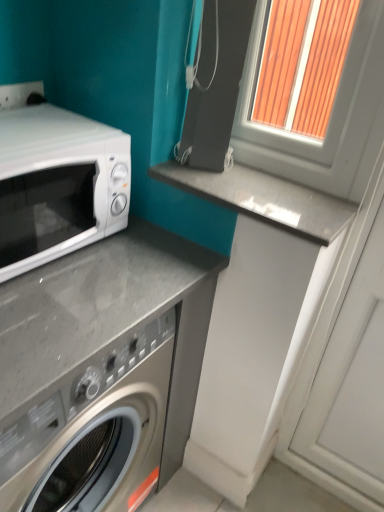
Question: Can you confirm if gray polished stone counter top at center is positioned to the right of white glossy microwave at left?

Choices:
 (A) no
 (B) yes

Answer: (B)

Question: From the image's perspective, is gray polished stone counter top at center beneath white glossy microwave at left?

Choices:
 (A) yes
 (B) no

Answer: (B)

Question: Can you confirm if gray polished stone counter top at center is thinner than white glossy microwave at left?

Choices:
 (A) no
 (B) yes

Answer: (B)

Question: Is gray polished stone counter top at center directly adjacent to white glossy microwave at left?

Choices:
 (A) yes
 (B) no

Answer: (B)

Question: Considering the relative positions of gray polished stone counter top at center and white glossy microwave at left in the image provided, is gray polished stone counter top at center behind white glossy microwave at left?

Choices:
 (A) yes
 (B) no

Answer: (A)

Question: Is white plastic window frame at upper right to the left or to the right of gray polished stone counter top at center in the image?

Choices:
 (A) left
 (B) right

Answer: (B)

Question: Is white plastic window frame at upper right taller or shorter than gray polished stone counter top at center?

Choices:
 (A) short
 (B) tall

Answer: (B)

Question: From the image's perspective, is white plastic window frame at upper right positioned above or below gray polished stone counter top at center?

Choices:
 (A) above
 (B) below

Answer: (A)

Question: In the image, is white plastic window frame at upper right positioned in front of or behind gray polished stone counter top at center?

Choices:
 (A) front
 (B) behind

Answer: (A)

Question: Considering the positions of gray polished stone counter top at center and white plastic window frame at upper right in the image, is gray polished stone counter top at center taller or shorter than white plastic window frame at upper right?

Choices:
 (A) short
 (B) tall

Answer: (A)

Question: In terms of width, does gray polished stone counter top at center look wider or thinner when compared to white plastic window frame at upper right?

Choices:
 (A) wide
 (B) thin

Answer: (A)

Question: From a real-world perspective, is gray polished stone counter top at center positioned above or below white plastic window frame at upper right?

Choices:
 (A) below
 (B) above

Answer: (A)

Question: Is point (210, 200) closer or farther from the camera than point (249, 94)?

Choices:
 (A) closer
 (B) farther

Answer: (A)

Question: Considering the positions of white glossy microwave at left and white plastic window frame at upper right in the image, is white glossy microwave at left wider or thinner than white plastic window frame at upper right?

Choices:
 (A) thin
 (B) wide

Answer: (B)

Question: From a real-world perspective, relative to white plastic window frame at upper right, is white glossy microwave at left vertically above or below?

Choices:
 (A) above
 (B) below

Answer: (B)